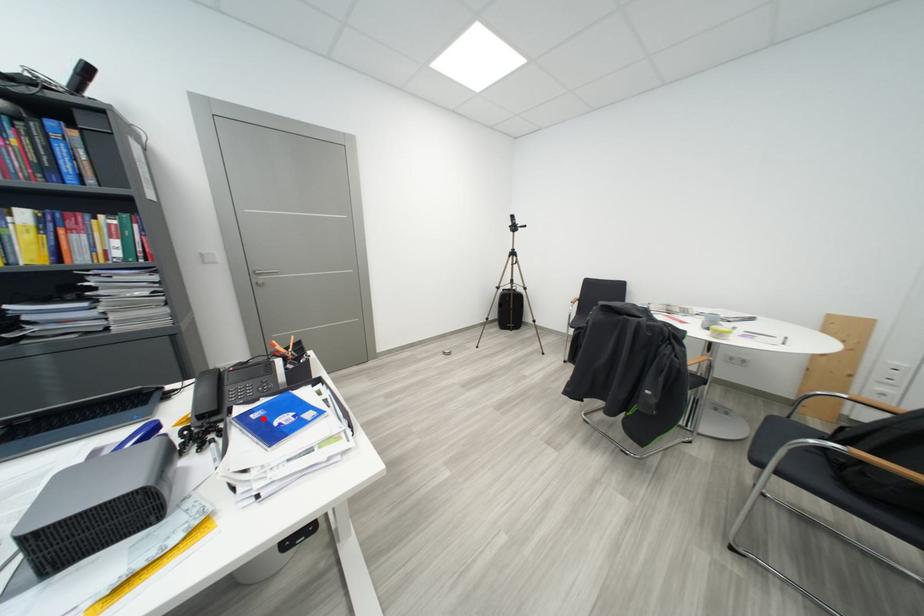
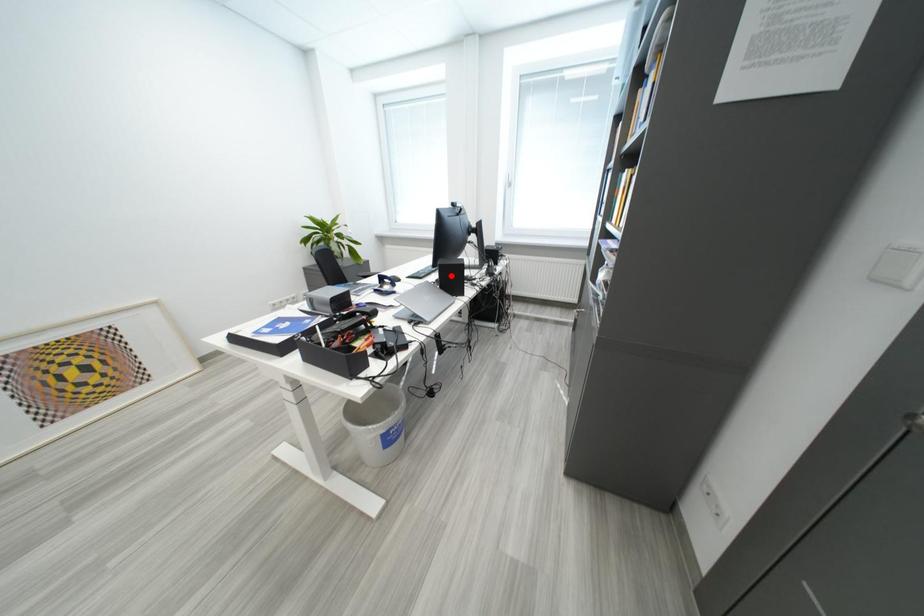
From the picture: I am providing you with two images of the same scene from different viewpoints. A red point is marked on the first image and another point is marked on the second image. Is the marked point in image1 the same physical position as the marked point in image2?

No